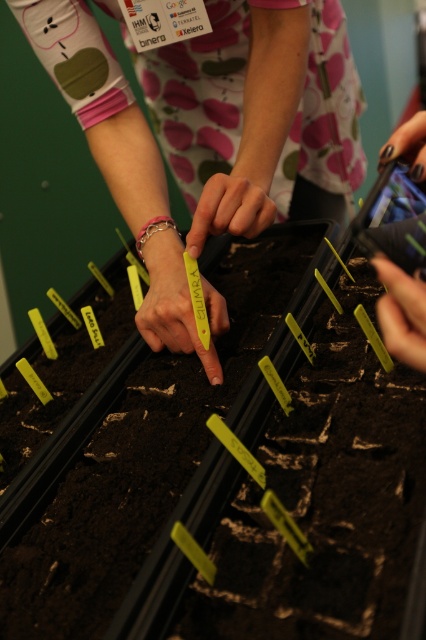
Question: Estimate the real-world distances between objects in this image. Which object is closer to the yellow paper at right?

Choices:
 (A) smooth yellow tag at center
 (B) black nail polish at center
 (C) yellow plastic tag at center

Answer: (B)

Question: Which point is closer to the camera taking this photo?

Choices:
 (A) (268, 45)
 (B) (273, 22)
 (C) (212, 365)

Answer: (C)

Question: Can you confirm if yellow paper at right is positioned to the left of black nail polish at center?

Choices:
 (A) yes
 (B) no

Answer: (A)

Question: Which point appears closest to the camera in this image?

Choices:
 (A) (157, 301)
 (B) (411, 323)
 (C) (226, 22)
 (D) (221, 220)

Answer: (B)

Question: Can you confirm if smooth yellow tag at center is smaller than yellow paper at right?

Choices:
 (A) yes
 (B) no

Answer: (B)

Question: Does yellow paper tag at center have a lesser width compared to black nail polish at center?

Choices:
 (A) no
 (B) yes

Answer: (A)